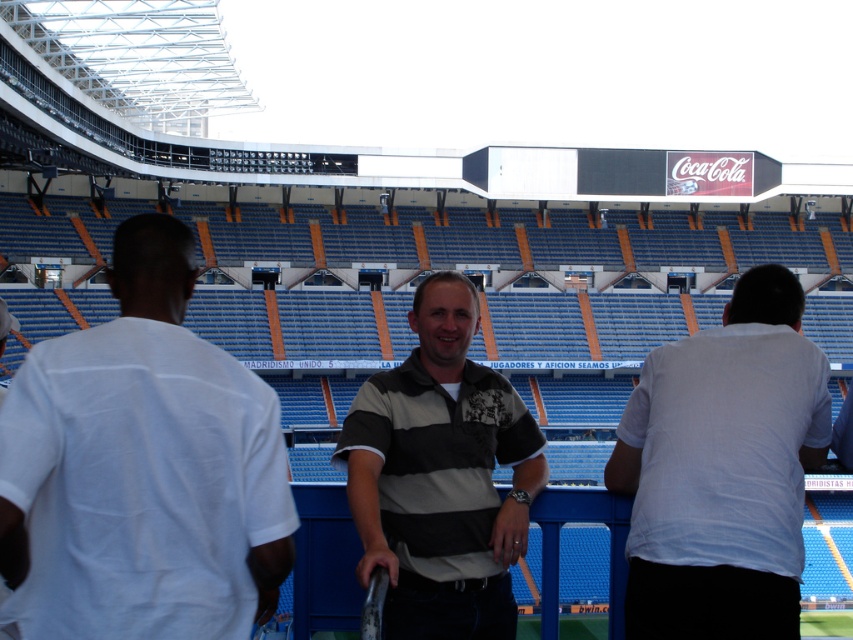
How much distance is there between white cotton shirt at center and white cotton shirt at right?

white cotton shirt at center and white cotton shirt at right are 15.56 meters apart from each other.

Consider the image. Which is below, white cotton shirt at center or white cotton shirt at right?

white cotton shirt at center

Between point (172, 467) and point (767, 538), which one is positioned behind?

Point (767, 538)

This screenshot has height=640, width=853. Identify the location of white cotton shirt at center. (143, 467).

Is white cotton shirt at right in front of striped cotton shirt at center?

Yes.

Does white cotton shirt at right appear on the left side of striped cotton shirt at center?

No, white cotton shirt at right is not to the left of striped cotton shirt at center.

Which is behind, point (741, 632) or point (468, 540)?

Point (468, 540)

Identify the location of white cotton shirt at right. (723, 468).

How distant is white cotton shirt at center from striped cotton shirt at center?

white cotton shirt at center is 10.86 meters away from striped cotton shirt at center.

Who is more distant from viewer, (196, 396) or (526, 408)?

The point (526, 408) is behind.

Does point (213, 413) come farther from viewer compared to point (386, 410)?

No, (213, 413) is in front of (386, 410).

You are a GUI agent. You are given a task and a screenshot of the screen. Output one action in this format:
    pyautogui.click(x=<x>, y=<y>)
    Task: Click on the white cotton shirt at center
    Image resolution: width=853 pixels, height=640 pixels.
    Given the screenshot: What is the action you would take?
    pyautogui.click(x=143, y=467)